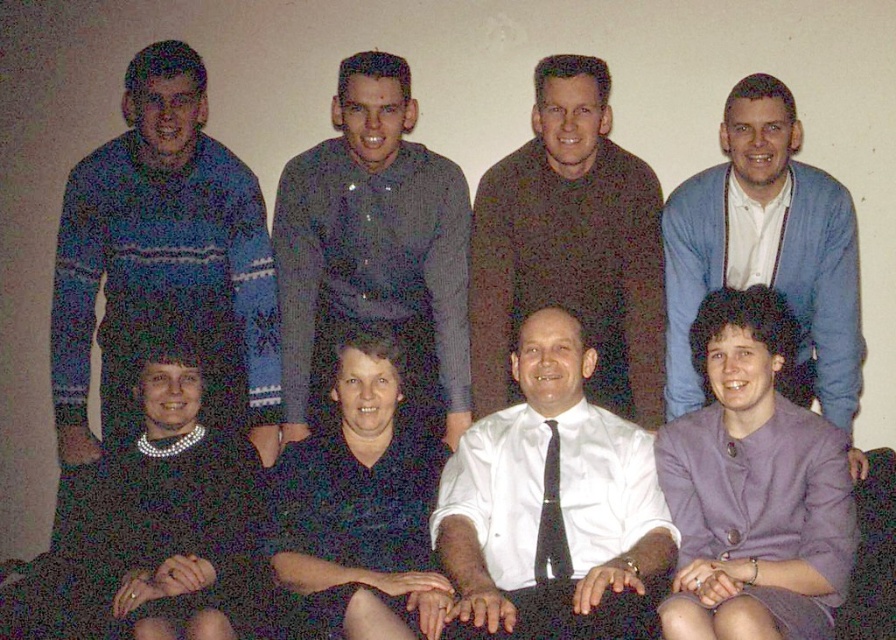
Between point (366, 140) and point (369, 490), which one is positioned in front?

Positioned in front is point (369, 490).

From the picture: Does dark gray textured shirt at center appear on the right side of dark blue shirt at center?

Indeed, dark gray textured shirt at center is positioned on the right side of dark blue shirt at center.

Locate an element on the screen. The width and height of the screenshot is (896, 640). dark gray textured shirt at center is located at coordinates (373, 244).

Which of these two, dark brown sweater at upper center or blue cardigan at upper right, stands taller?

blue cardigan at upper right

Is point (617, 346) positioned before point (679, 186)?

No, (617, 346) is behind (679, 186).

I want to click on dark brown sweater at upper center, so pos(570,244).

Does dark gray textured shirt at center have a greater width compared to black silk tie at center?

Yes.

Does dark gray textured shirt at center appear on the right side of black silk tie at center?

Incorrect, dark gray textured shirt at center is not on the right side of black silk tie at center.

Describe the element at coordinates (373, 244) in the screenshot. This screenshot has width=896, height=640. I see `dark gray textured shirt at center` at that location.

Locate an element on the screen. dark gray textured shirt at center is located at coordinates (373, 244).